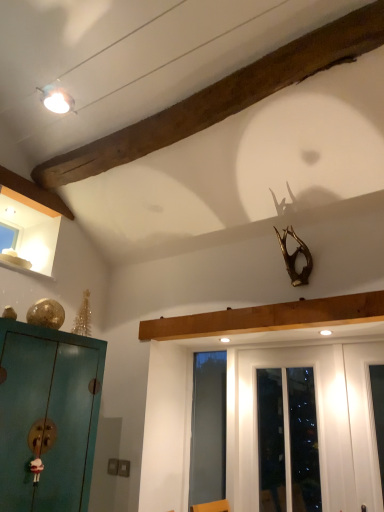
Question: From a real-world perspective, is transparent glass screen door at center located higher than wooden beam at upper left?

Choices:
 (A) yes
 (B) no

Answer: (B)

Question: Is transparent glass screen door at center next to wooden beam at upper left?

Choices:
 (A) no
 (B) yes

Answer: (A)

Question: Considering the relative positions of transparent glass screen door at center and wooden beam at upper left in the image provided, is transparent glass screen door at center to the right of wooden beam at upper left from the viewer's perspective?

Choices:
 (A) yes
 (B) no

Answer: (A)

Question: From the image's perspective, is transparent glass screen door at center over wooden beam at upper left?

Choices:
 (A) no
 (B) yes

Answer: (A)

Question: Can we say transparent glass screen door at center lies outside wooden beam at upper left?

Choices:
 (A) yes
 (B) no

Answer: (A)

Question: Is teal matte cabinet at left taller or shorter than white glossy door at center?

Choices:
 (A) short
 (B) tall

Answer: (A)

Question: From the image's perspective, is teal matte cabinet at left located above or below white glossy door at center?

Choices:
 (A) below
 (B) above

Answer: (B)

Question: Would you say teal matte cabinet at left is to the left or to the right of white glossy door at center in the picture?

Choices:
 (A) left
 (B) right

Answer: (A)

Question: Considering their positions, is teal matte cabinet at left located in front of or behind white glossy door at center?

Choices:
 (A) front
 (B) behind

Answer: (A)

Question: Considering the positions of transparent glass screen door at center and white glossy door at center in the image, is transparent glass screen door at center taller or shorter than white glossy door at center?

Choices:
 (A) short
 (B) tall

Answer: (B)

Question: Considering the positions of point (205, 398) and point (342, 354), is point (205, 398) closer or farther from the camera than point (342, 354)?

Choices:
 (A) closer
 (B) farther

Answer: (B)

Question: From the image's perspective, is transparent glass screen door at center above or below white glossy door at center?

Choices:
 (A) above
 (B) below

Answer: (B)

Question: Is transparent glass screen door at center in front of or behind white glossy door at center in the image?

Choices:
 (A) front
 (B) behind

Answer: (B)

Question: Choose the correct answer: Is transparent glass screen door at center inside wooden beam at upper left or outside it?

Choices:
 (A) inside
 (B) outside

Answer: (B)

Question: From the image's perspective, is transparent glass screen door at center located above or below wooden beam at upper left?

Choices:
 (A) above
 (B) below

Answer: (B)